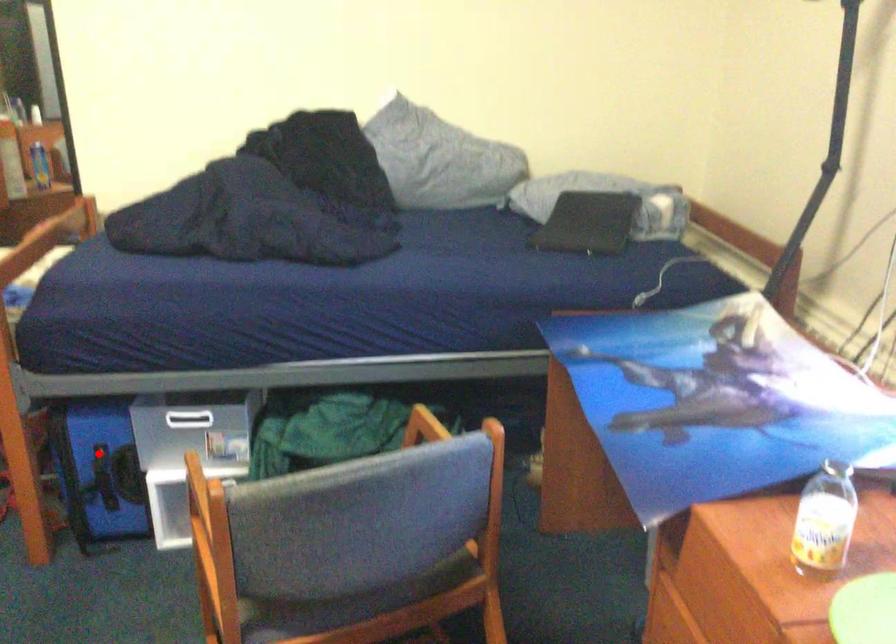
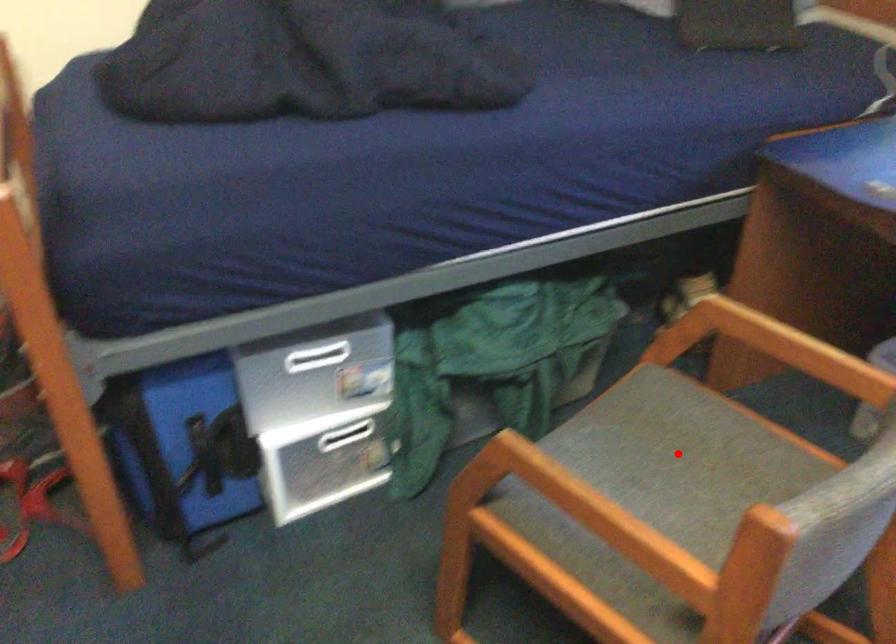
I am providing you with two images of the same scene from different viewpoints. A red point is marked on the first image and another point is marked on the second image. Does the point marked in image1 correspond to the same location as the one in image2?

No